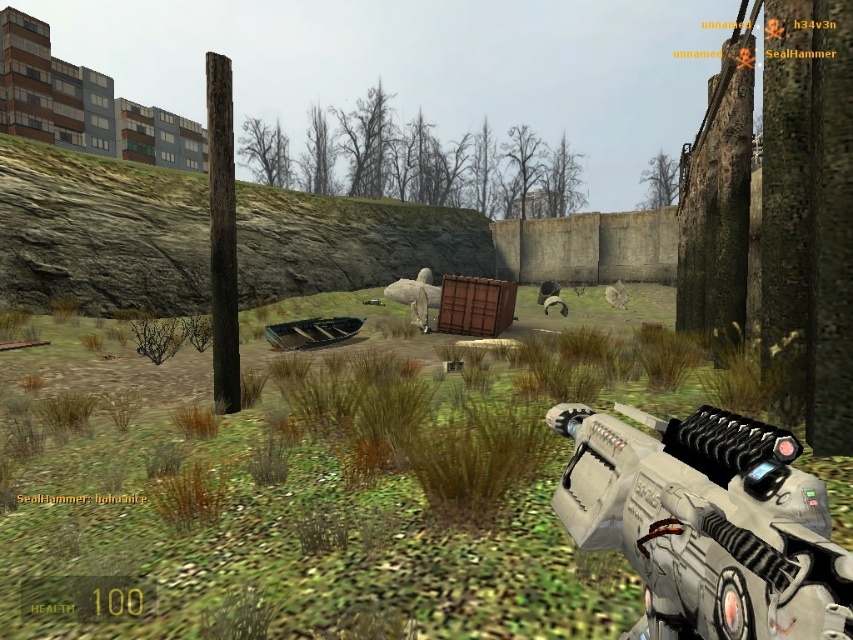
Question: Which point is farther from the camera taking this photo?

Choices:
 (A) (663, 566)
 (B) (618, 282)

Answer: (B)

Question: Which point appears closest to the camera in this image?

Choices:
 (A) (610, 435)
 (B) (625, 298)

Answer: (A)

Question: Is metallic silver gun at lower right smaller than furry gray animal at center?

Choices:
 (A) yes
 (B) no

Answer: (A)

Question: Which of the following is the farthest from the observer?

Choices:
 (A) furry gray animal at center
 (B) metallic silver gun at lower right

Answer: (A)

Question: Can you confirm if metallic silver gun at lower right is bigger than furry gray animal at center?

Choices:
 (A) yes
 (B) no

Answer: (B)

Question: Does metallic silver gun at lower right lie in front of furry gray animal at center?

Choices:
 (A) yes
 (B) no

Answer: (A)